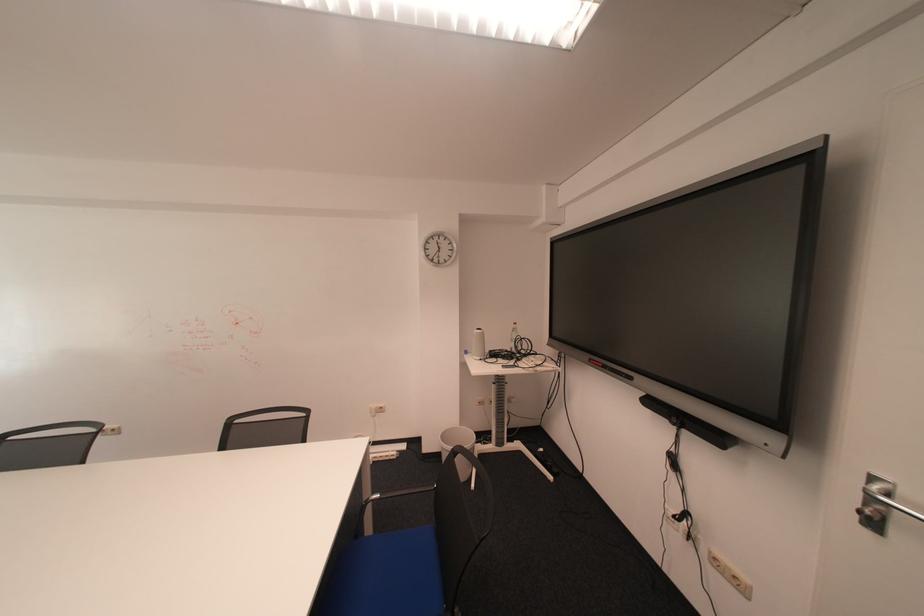
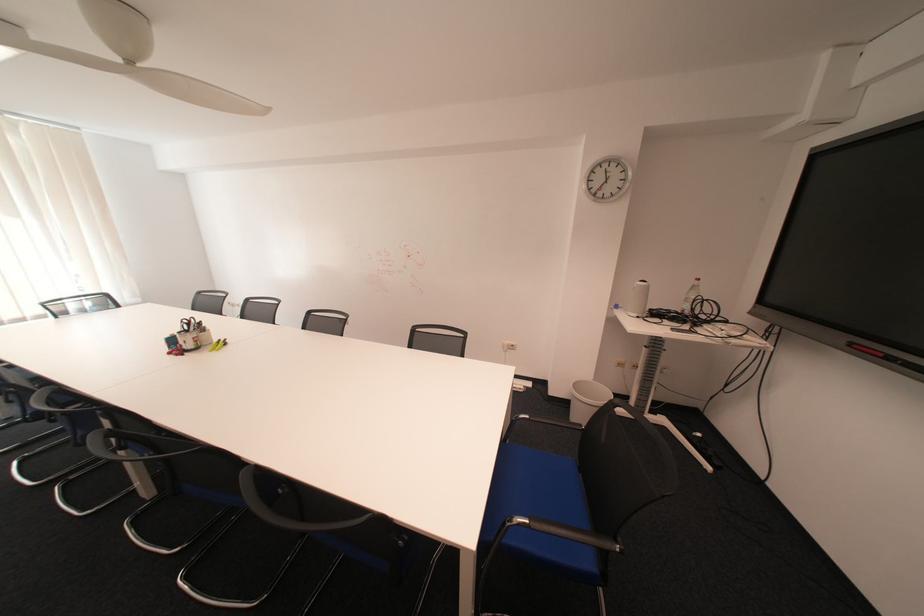
Question: Based on the continuous images, in which direction is the camera rotating? Reply with the corresponding letter.

Choices:
 (A) Left
 (B) Right
 (C) Up
 (D) Down

Answer: (A)